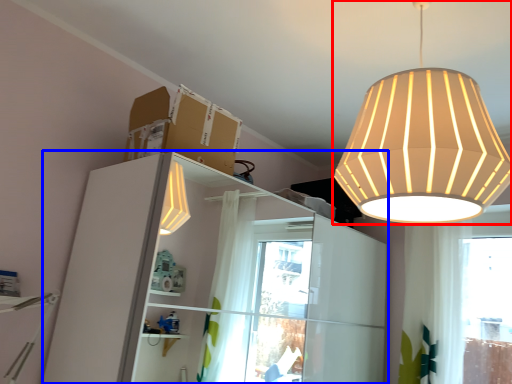
Question: Which object is further to the camera taking this photo, lamp (highlighted by a red box) or dresser (highlighted by a blue box)?

Choices:
 (A) lamp
 (B) dresser

Answer: (B)